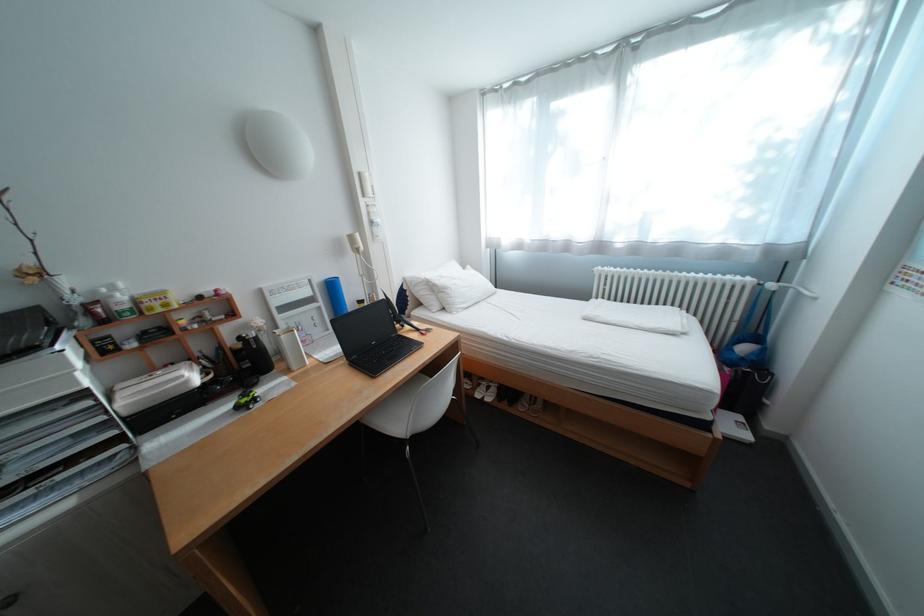
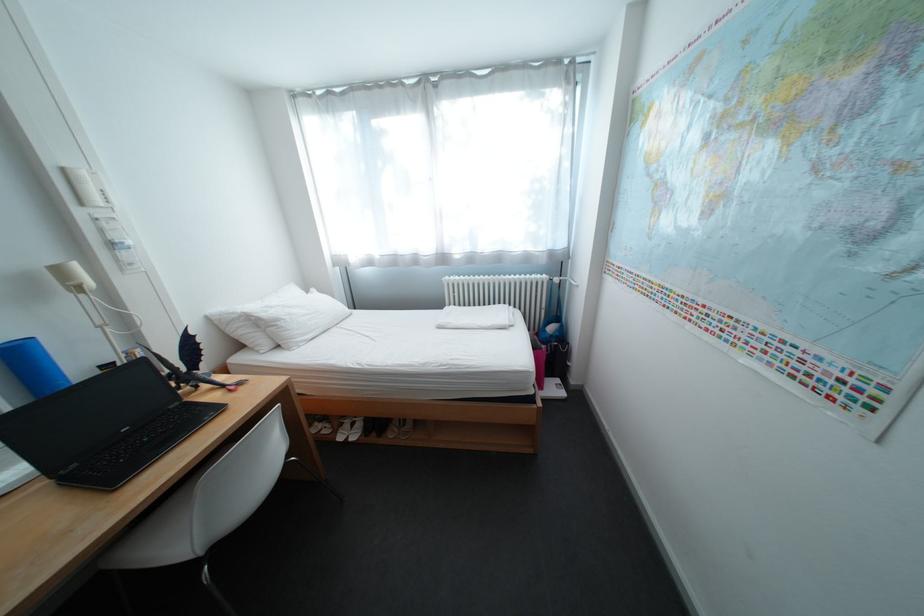
Locate, in the second image, the point that corresponds to (491,390) in the first image.

(353, 431)